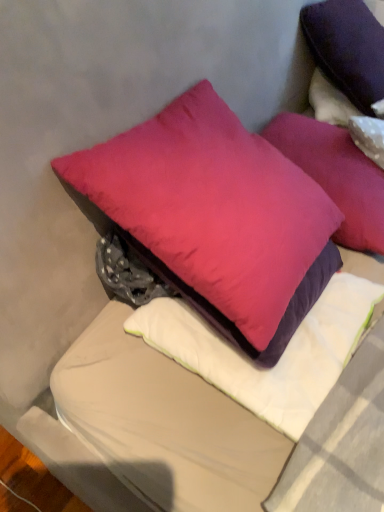
Question: From the image's perspective, is purple matte pillow at upper right, the second pillow from the top, located beneath satin purple pillow at center, arranged as the 1th pillow when ordered from the bottom?

Choices:
 (A) yes
 (B) no

Answer: (B)

Question: Could you tell me if purple matte pillow at upper right, the second pillow from the top, is facing satin purple pillow at center, arranged as the 1th pillow when ordered from the bottom?

Choices:
 (A) yes
 (B) no

Answer: (B)

Question: Can satin purple pillow at center, the 5th pillow when ordered from top to bottom, be found inside purple matte pillow at upper right, placed as the 4th pillow when sorted from bottom to top?

Choices:
 (A) yes
 (B) no

Answer: (B)

Question: Can you confirm if purple matte pillow at upper right, placed as the 4th pillow when sorted from bottom to top, is thinner than satin purple pillow at center, arranged as the 1th pillow when ordered from the bottom?

Choices:
 (A) no
 (B) yes

Answer: (B)

Question: Is the depth of purple matte pillow at upper right, the second pillow from the top, less than that of satin purple pillow at center, the 5th pillow when ordered from top to bottom?

Choices:
 (A) no
 (B) yes

Answer: (A)

Question: Considering the relative sizes of purple matte pillow at upper right, the second pillow from the top, and satin purple pillow at center, the 5th pillow when ordered from top to bottom, in the image provided, is purple matte pillow at upper right, the second pillow from the top, bigger than satin purple pillow at center, the 5th pillow when ordered from top to bottom,?

Choices:
 (A) no
 (B) yes

Answer: (B)

Question: Is satin purple pillow at center, arranged as the 1th pillow when ordered from the bottom, wider than matte pink pillow at center, the second pillow in the bottom-to-top sequence?

Choices:
 (A) yes
 (B) no

Answer: (B)

Question: Can you confirm if satin purple pillow at center, the 5th pillow when ordered from top to bottom, is shorter than matte pink pillow at center, the second pillow in the bottom-to-top sequence?

Choices:
 (A) yes
 (B) no

Answer: (A)

Question: Is matte pink pillow at center, positioned as the 4th pillow in top-to-bottom order, a part of satin purple pillow at center, arranged as the 1th pillow when ordered from the bottom?

Choices:
 (A) no
 (B) yes

Answer: (A)

Question: Considering the relative sizes of satin purple pillow at center, the 5th pillow when ordered from top to bottom, and matte pink pillow at center, the second pillow in the bottom-to-top sequence, in the image provided, is satin purple pillow at center, the 5th pillow when ordered from top to bottom, smaller than matte pink pillow at center, the second pillow in the bottom-to-top sequence,?

Choices:
 (A) no
 (B) yes

Answer: (B)

Question: Is satin purple pillow at center, the 5th pillow when ordered from top to bottom, next to matte pink pillow at center, positioned as the 4th pillow in top-to-bottom order?

Choices:
 (A) yes
 (B) no

Answer: (B)

Question: Is satin purple pillow at center, the 5th pillow when ordered from top to bottom, further to the viewer compared to matte pink pillow at center, positioned as the 4th pillow in top-to-bottom order?

Choices:
 (A) no
 (B) yes

Answer: (B)

Question: Considering the relative sizes of purple velvet pillow at upper right, marked as the 5th pillow in a bottom-to-top arrangement, and matte pink pillow at center, marked as the third pillow in a bottom-to-top arrangement, in the image provided, is purple velvet pillow at upper right, marked as the 5th pillow in a bottom-to-top arrangement, bigger than matte pink pillow at center, marked as the third pillow in a bottom-to-top arrangement,?

Choices:
 (A) yes
 (B) no

Answer: (A)